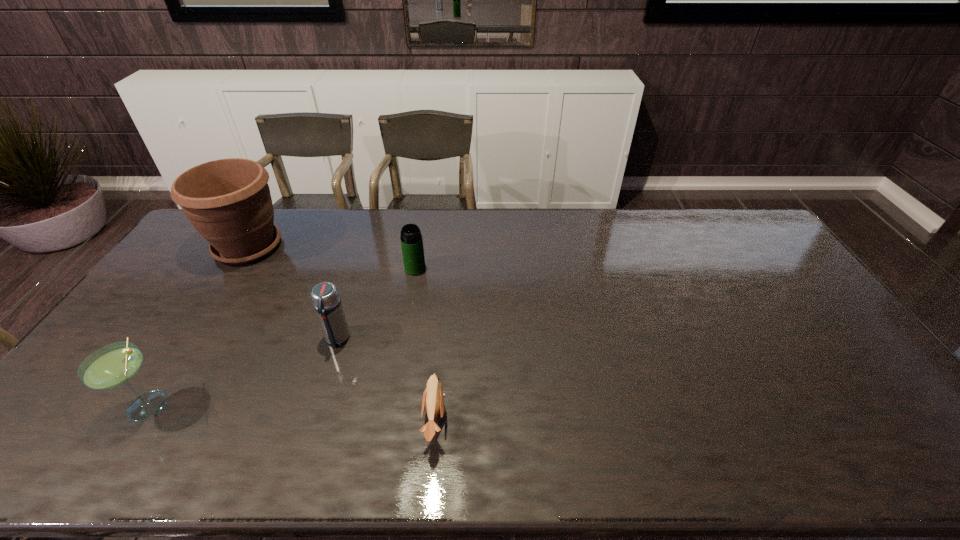
I want to click on free spot located with a handle on the side of the third farthest object, so click(319, 399).

Locate an element on the screen. vacant space located 0.130m on the right of the martini is located at coordinates (227, 404).

Locate an element on the screen. Image resolution: width=960 pixels, height=540 pixels. free location located at the beak of the bird is located at coordinates (565, 420).

I want to click on object located at the far edge, so click(228, 201).

This screenshot has width=960, height=540. I want to click on object located in the near edge section of the desktop, so click(433, 398).

At what (x,y) coordinates should I click in order to perform the action: click on flowerpot present at the left edge. Please return your answer as a coordinate pair (x, y). Looking at the image, I should click on (228, 201).

Locate an element on the screen. martini that is positioned at the left edge is located at coordinates (115, 364).

Locate an element on the screen. The image size is (960, 540). object at the far left corner is located at coordinates (228, 201).

This screenshot has height=540, width=960. What are the coordinates of `blank space at the far edge` in the screenshot? It's located at (421, 227).

This screenshot has height=540, width=960. In order to click on vacant space at the near edge of the desktop in this screenshot , I will do `click(200, 440)`.